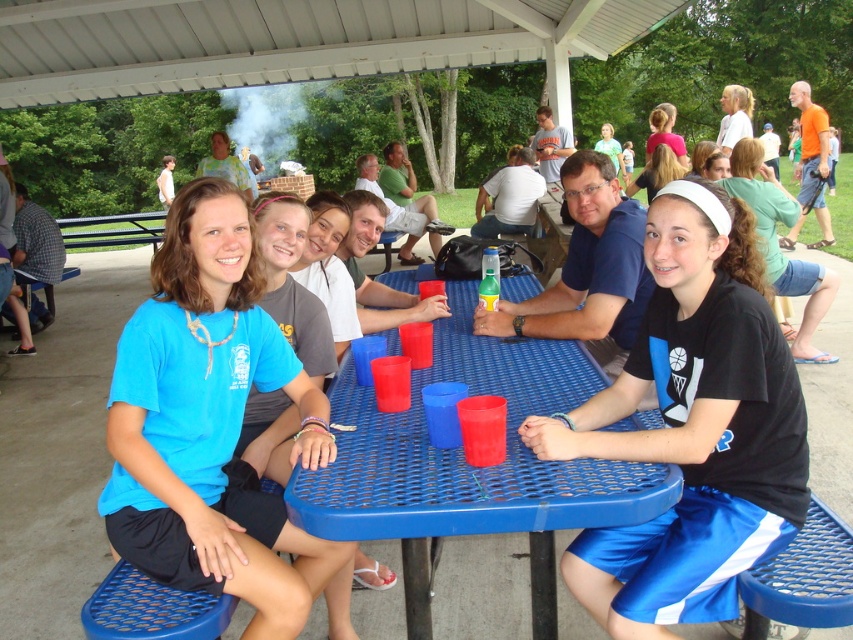
Question: Can you confirm if blue plastic table at center is positioned to the left of matte gray shirt at center?

Choices:
 (A) yes
 (B) no

Answer: (B)

Question: Is black matte shirt at center wider than black fabric headband at center?

Choices:
 (A) no
 (B) yes

Answer: (A)

Question: Among these objects, which one is farthest from the camera?

Choices:
 (A) blue fabric shirt at center
 (B) black matte shirt at center

Answer: (A)

Question: Is black matte shirt at center positioned behind matte gray shirt at center?

Choices:
 (A) yes
 (B) no

Answer: (B)

Question: Which point is farther to the camera?

Choices:
 (A) black fabric headband at center
 (B) matte white headband at center

Answer: (B)

Question: Estimate the real-world distances between objects in this image. Which object is farther from the black fabric headband at center?

Choices:
 (A) pink fabric ponytail at upper center
 (B) blue fabric shirt at center
 (C) blue plastic table at center
 (D) matte white headband at center

Answer: (B)